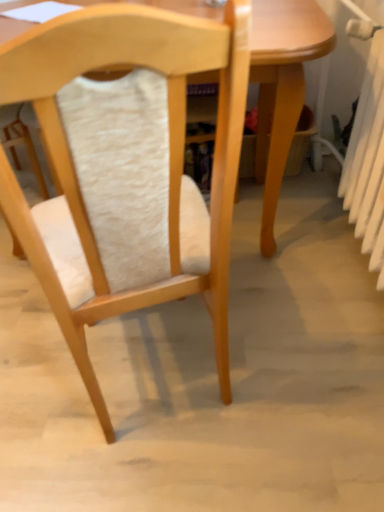
Where is `white plastic radiator at right`? white plastic radiator at right is located at coordinates (368, 162).

Locate an element on the screen. The image size is (384, 512). light wood table at center is located at coordinates (282, 87).

Which is correct: white plastic radiator at right is inside light wood table at center, or outside of it?

white plastic radiator at right is not inside light wood table at center, it's outside.

Does white plastic radiator at right appear on the right side of light wood table at center?

Yes.

This screenshot has height=512, width=384. Identify the location of table below the white plastic radiator at right (from a real-world perspective). (282, 87).

Is white plastic radiator at right in front of or behind wooden chair at center in the image?

In the image, white plastic radiator at right appears behind wooden chair at center.

In the image, there is a wooden chair at center. At what (x,y) coordinates should I click in order to perform the action: click on radiator below it (from a real-world perspective). Please return your answer as a coordinate pair (x, y). Looking at the image, I should click on (368, 162).

From the image's perspective, does white plastic radiator at right appear lower than wooden chair at center?

No.

Which object is further away from the camera taking this photo, light wood table at center or white plastic radiator at right?

light wood table at center is further away from the camera.

Where is `table behind the white plastic radiator at right`? This screenshot has width=384, height=512. table behind the white plastic radiator at right is located at coordinates (282, 87).

Is light wood table at center next to white plastic radiator at right and touching it?

There is a gap between light wood table at center and white plastic radiator at right.

Is white plastic radiator at right located within light wood table at center?

No, light wood table at center does not contain white plastic radiator at right.

Is light wood table at center at the back of wooden chair at center?

No, wooden chair at center is not facing away from light wood table at center.

Would you say wooden chair at center is inside or outside light wood table at center?

wooden chair at center lies outside light wood table at center.

Relative to light wood table at center, is wooden chair at center in front or behind?

wooden chair at center is positioned closer to the viewer than light wood table at center.

Is wooden chair at center taller or shorter than light wood table at center?

Clearly, wooden chair at center is taller compared to light wood table at center.

Is wooden chair at center completely or partially outside of white plastic radiator at right?

wooden chair at center is positioned outside white plastic radiator at right.

Considering the positions of objects wooden chair at center and white plastic radiator at right in the image provided, who is more to the left, wooden chair at center or white plastic radiator at right?

wooden chair at center.

Does wooden chair at center turn towards white plastic radiator at right?

No.

Can you confirm if wooden chair at center is taller than white plastic radiator at right?

Indeed, wooden chair at center has a greater height compared to white plastic radiator at right.

From the image's perspective, which one is positioned higher, light wood table at center or wooden chair at center?

From the image's view, light wood table at center is above.

Is point (269, 119) closer or farther from the camera than point (226, 32)?

Point (269, 119) appears to be farther away from the viewer than point (226, 32).

From a real-world perspective, is light wood table at center positioned above or below wooden chair at center?

light wood table at center is below wooden chair at center.

Find the location of a particular element. radiator above the light wood table at center (from a real-world perspective) is located at coordinates (368, 162).

At what (x,y) coordinates should I click in order to perform the action: click on radiator below the wooden chair at center (from a real-world perspective). Please return your answer as a coordinate pair (x, y). This screenshot has height=512, width=384. Looking at the image, I should click on (368, 162).

Estimate the real-world distances between objects in this image. Which object is further from light wood table at center, wooden chair at center or white plastic radiator at right?

wooden chair at center lies further to light wood table at center than the other object.

Considering their positions, is light wood table at center positioned closer to wooden chair at center than white plastic radiator at right?

Based on the image, light wood table at center appears to be nearer to wooden chair at center.

Estimate the real-world distances between objects in this image. Which object is further from white plastic radiator at right, light wood table at center or wooden chair at center?

wooden chair at center.

Which object lies nearer to the anchor point light wood table at center, white plastic radiator at right or wooden chair at center?

white plastic radiator at right is positioned closer to the anchor light wood table at center.

Considering their positions, is white plastic radiator at right positioned closer to wooden chair at center than light wood table at center?

light wood table at center lies closer to wooden chair at center than the other object.

When comparing their distances from white plastic radiator at right, does wooden chair at center or light wood table at center seem closer?

light wood table at center.

What are the coordinates of `chair situated between light wood table at center and white plastic radiator at right from left to right` in the screenshot? It's located at (127, 167).